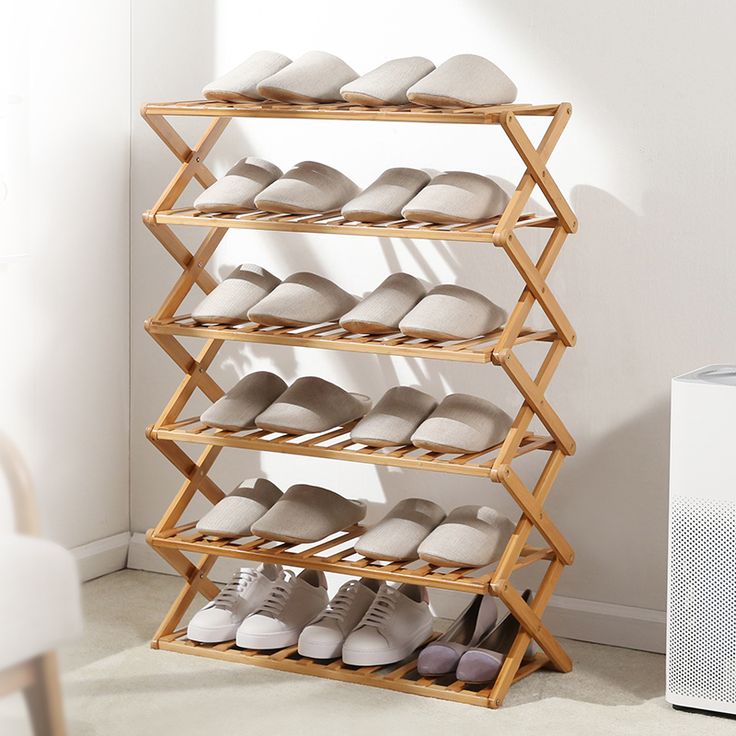
Where is `the left slipper`? This screenshot has width=736, height=736. the left slipper is located at coordinates (478, 531), (304, 513), (447, 425), (300, 408), (294, 291), (447, 191), (319, 177), (308, 65), (467, 79).